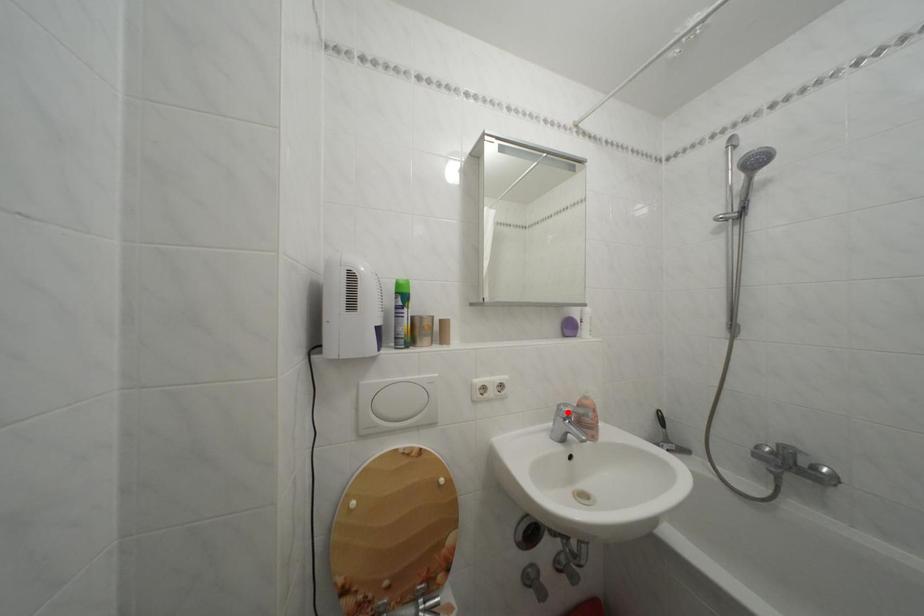
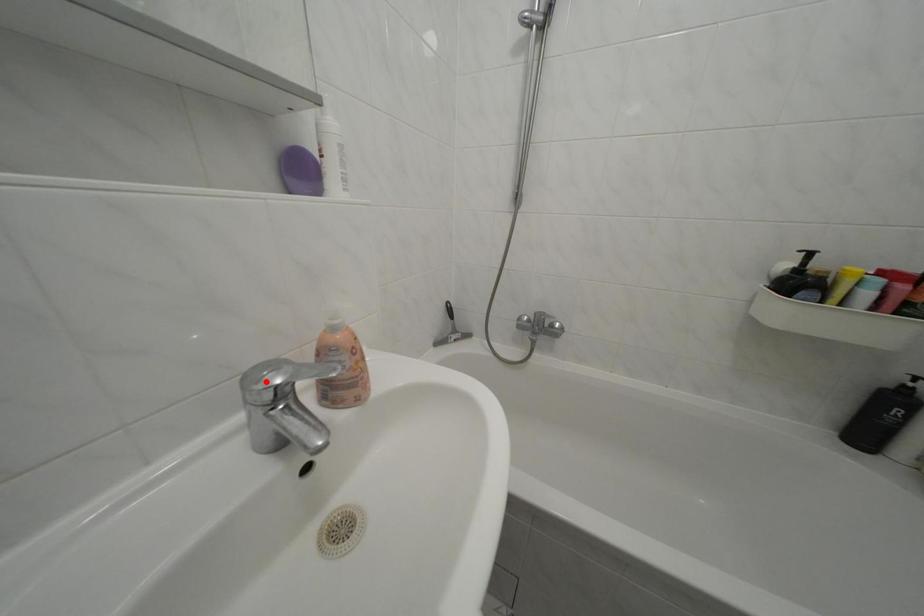
I am providing you with two images of the same scene from different viewpoints. A red point is marked on the first image and another point is marked on the second image. Does the point marked in image1 correspond to the same location as the one in image2?

No